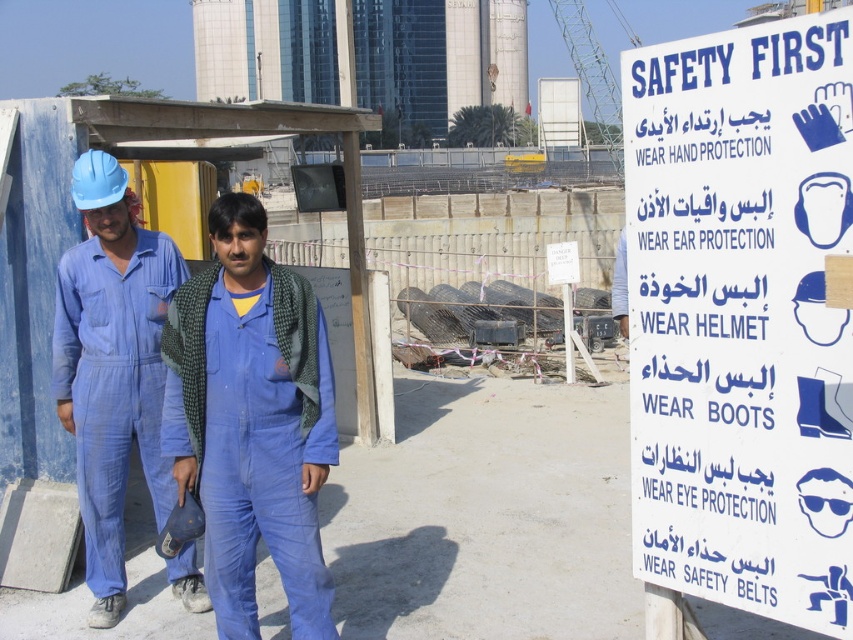
Question: Which of the following is the closest to the observer?

Choices:
 (A) (640, 390)
 (B) (229, 588)

Answer: (A)

Question: Which point is farther from the camera taking this photo?

Choices:
 (A) (656, 305)
 (B) (160, 269)
 (C) (199, 365)

Answer: (B)

Question: Is blue matte jumpsuit at center bigger than blue fabric jumpsuit at center?

Choices:
 (A) no
 (B) yes

Answer: (A)

Question: Does white paper sign at upper right have a greater width compared to blue fabric jumpsuit at center?

Choices:
 (A) yes
 (B) no

Answer: (B)

Question: Which object appears farthest from the camera in this image?

Choices:
 (A) blue matte jumpsuit at center
 (B) blue fabric jumpsuit at center
 (C) white paper sign at upper right

Answer: (B)

Question: Is blue matte jumpsuit at center above blue fabric jumpsuit at center?

Choices:
 (A) no
 (B) yes

Answer: (A)